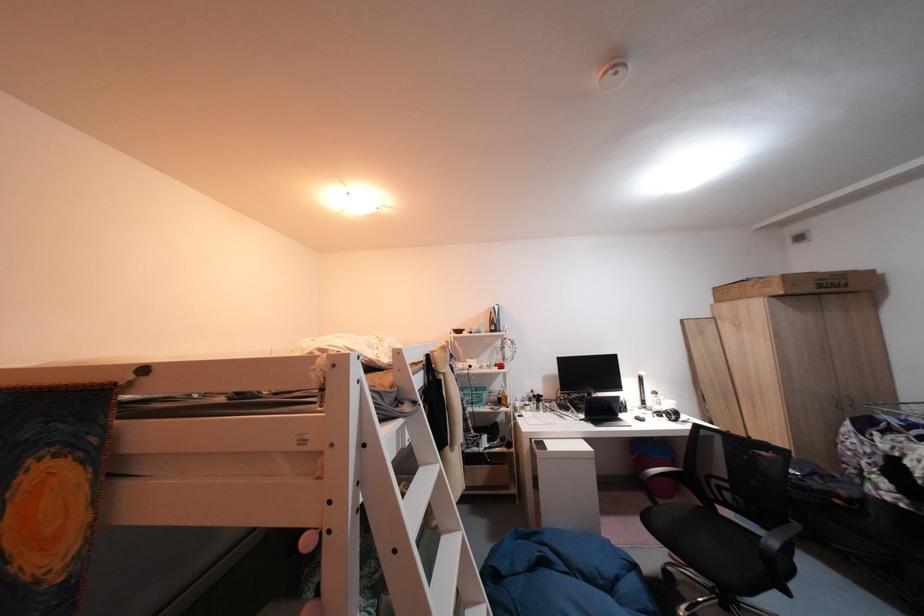
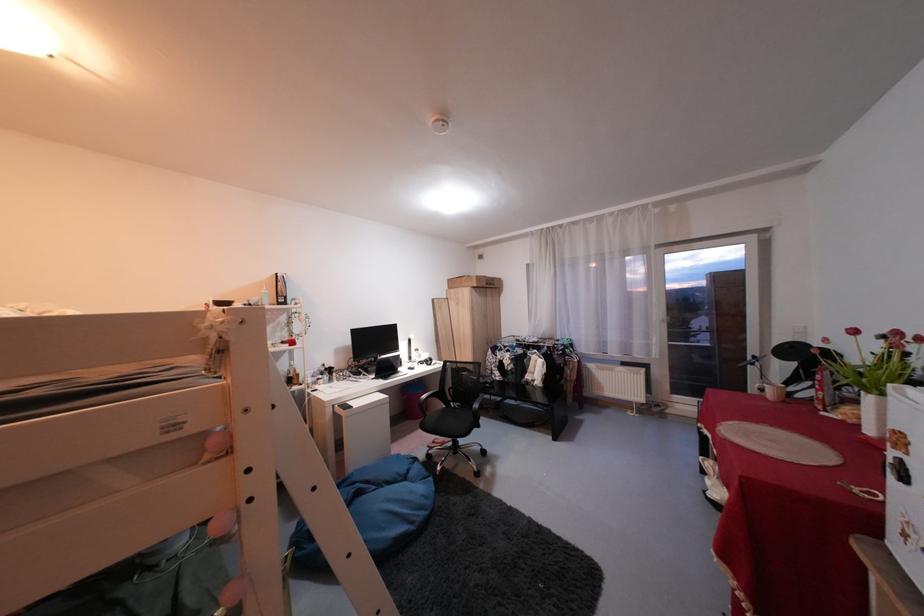
Question: The camera is either moving clockwise (left) or counter-clockwise (right) around the object. The first image is from the beginning of the video and the second image is from the end. Is the camera moving left or right when shooting the video?

Choices:
 (A) Left
 (B) Right

Answer: (A)